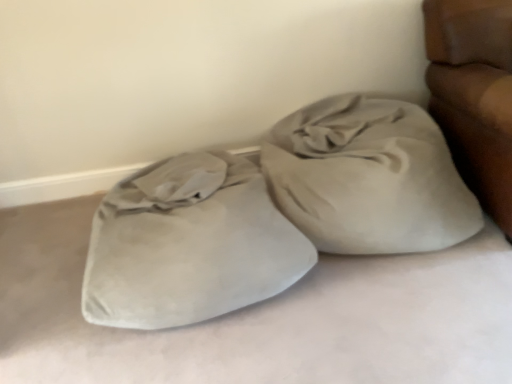
Question: Considering the relative sizes of suede-like beige sack at center-right and suede-like beige sleeping bag at lower left in the image provided, is suede-like beige sack at center-right bigger than suede-like beige sleeping bag at lower left?

Choices:
 (A) no
 (B) yes

Answer: (A)

Question: From the image's perspective, is suede-like beige sack at center-right located above suede-like beige sleeping bag at lower left?

Choices:
 (A) no
 (B) yes

Answer: (B)

Question: Is suede-like beige sack at center-right outside suede-like beige sleeping bag at lower left?

Choices:
 (A) no
 (B) yes

Answer: (B)

Question: From a real-world perspective, is suede-like beige sack at center-right on suede-like beige sleeping bag at lower left?

Choices:
 (A) no
 (B) yes

Answer: (B)

Question: Is suede-like beige sack at center-right oriented away from suede-like beige sleeping bag at lower left?

Choices:
 (A) yes
 (B) no

Answer: (B)

Question: Does suede-like beige sack at center-right have a greater height compared to suede-like beige sleeping bag at lower left?

Choices:
 (A) no
 (B) yes

Answer: (B)

Question: Is suede-like beige sleeping bag at lower left wider than suede-like beige sack at center-right?

Choices:
 (A) no
 (B) yes

Answer: (B)

Question: Is suede-like beige sleeping bag at lower left taller than suede-like beige sack at center-right?

Choices:
 (A) yes
 (B) no

Answer: (B)

Question: Can you confirm if suede-like beige sleeping bag at lower left is thinner than suede-like beige sack at center-right?

Choices:
 (A) yes
 (B) no

Answer: (B)

Question: Considering the relative sizes of suede-like beige sleeping bag at lower left and suede-like beige sack at center-right in the image provided, is suede-like beige sleeping bag at lower left bigger than suede-like beige sack at center-right?

Choices:
 (A) yes
 (B) no

Answer: (A)

Question: Is suede-like beige sleeping bag at lower left looking in the opposite direction of suede-like beige sack at center-right?

Choices:
 (A) yes
 (B) no

Answer: (B)

Question: Does suede-like beige sleeping bag at lower left lie behind suede-like beige sack at center-right?

Choices:
 (A) no
 (B) yes

Answer: (A)

Question: Based on their sizes in the image, would you say suede-like beige sack at center-right is bigger or smaller than suede-like beige sleeping bag at lower left?

Choices:
 (A) big
 (B) small

Answer: (B)